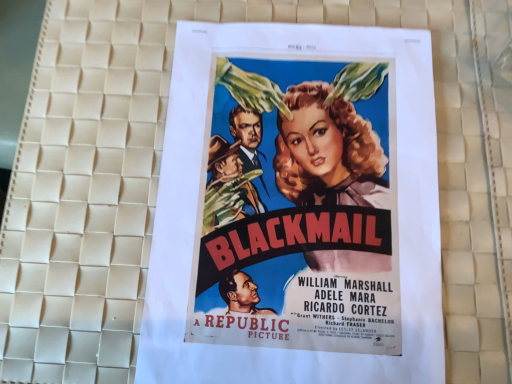
Identify the location of empty space that is ontop of matte paper poster at center. (282, 196).